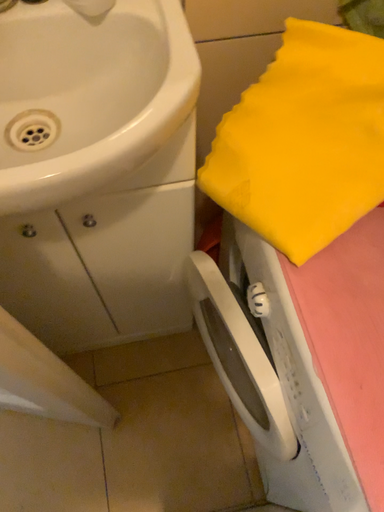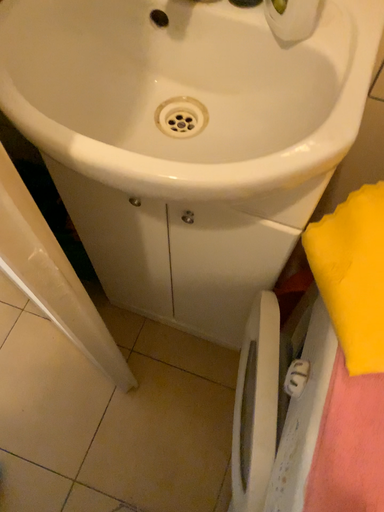
Question: How did the camera likely rotate when shooting the video?

Choices:
 (A) rotated left
 (B) rotated right

Answer: (A)